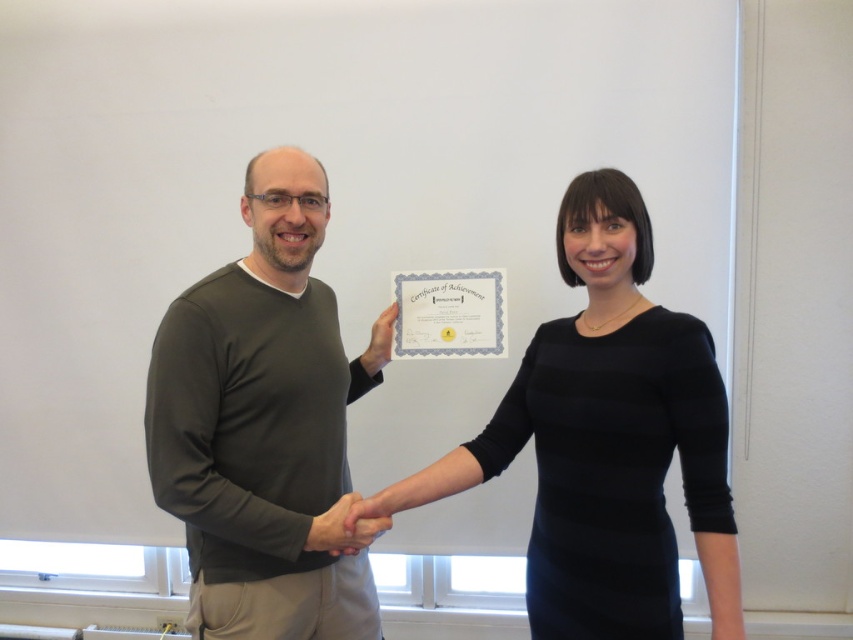
Question: Can you confirm if dark green sweater at center is positioned to the left of black matte dress at center?

Choices:
 (A) no
 (B) yes

Answer: (B)

Question: Does dark green sweater at center have a larger size compared to black matte dress at center?

Choices:
 (A) no
 (B) yes

Answer: (B)

Question: Is dark green sweater at center above black matte dress at center?

Choices:
 (A) no
 (B) yes

Answer: (A)

Question: Which point is closer to the camera?

Choices:
 (A) [x=601, y=225]
 (B) [x=293, y=582]

Answer: (A)